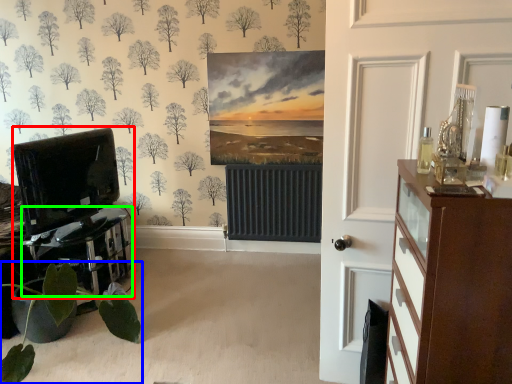
Question: Based on their relative distances, which object is farther from entertainment center (highlighted by a red box)? Choose from houseplant (highlighted by a blue box) and table (highlighted by a green box).

Choices:
 (A) houseplant
 (B) table

Answer: (A)